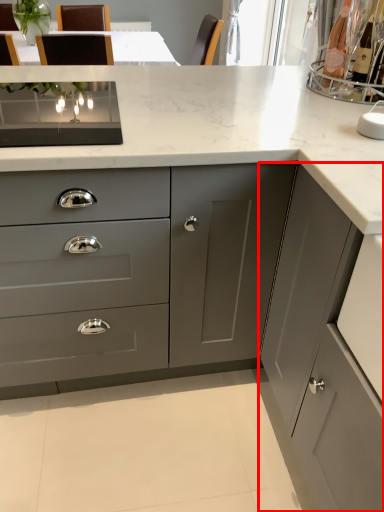
Question: In this image, where is cabinetry (annotated by the red box) located relative to cabinetry?

Choices:
 (A) right
 (B) left

Answer: (A)